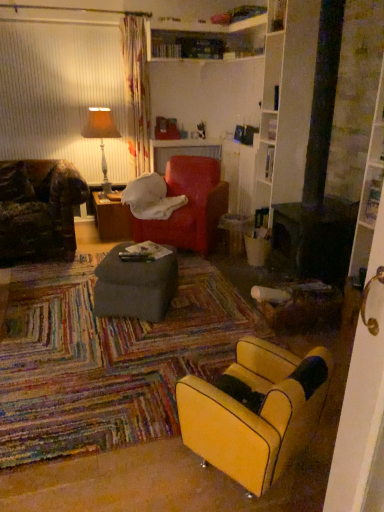
Question: From a real-world perspective, relative to matte gray ottoman at center, the 1th table from the bottom, is brown wood table at center, which ranks as the 1th table in left-to-right order, vertically above or below?

Choices:
 (A) below
 (B) above

Answer: (A)

Question: Is point (107, 236) positioned closer to the camera than point (114, 300)?

Choices:
 (A) closer
 (B) farther

Answer: (B)

Question: Estimate the real-world distances between objects in this image. Which object is farther from the orange fabric lampshade at upper left?

Choices:
 (A) matte gray ottoman at center, acting as the 2th table starting from the left
 (B) velvet red bean bag chair at center
 (C) yellow leather chair at lower right
 (D) brown wood table at center, which appears as the 2th table when viewed from the front

Answer: (C)

Question: Which of these objects is positioned farthest from the orange fabric lampshade at upper left?

Choices:
 (A) velvet red bean bag chair at center
 (B) matte gray ottoman at center, the 2th table in the back-to-front sequence
 (C) brown wood table at center, the second table when ordered from right to left
 (D) yellow leather chair at lower right

Answer: (D)